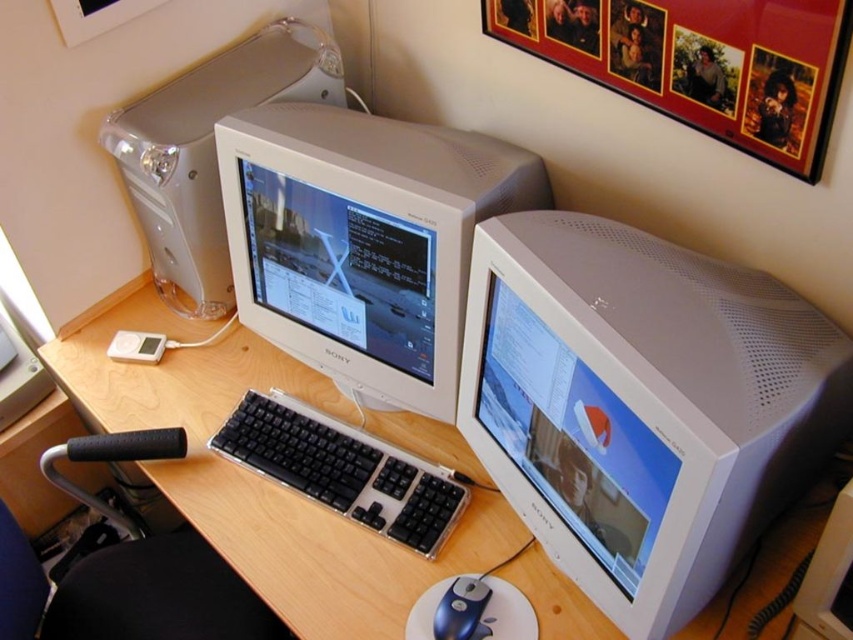
Question: Among these points, which one is farthest from the camera?

Choices:
 (A) (689, 588)
 (B) (136, 388)

Answer: (B)

Question: Which object is positioned closest to the white plastic monitor at center?

Choices:
 (A) white glossy monitor at center
 (B) black plastic keyboard at center
 (C) satin silver computer tower at upper left
 (D) wooden-framed photo at upper right

Answer: (A)

Question: Can you confirm if white plastic monitor at center is positioned below wooden-framed photo at upper right?

Choices:
 (A) yes
 (B) no

Answer: (A)

Question: Can you confirm if white glossy monitor at center is positioned to the right of black plastic keyboard at center?

Choices:
 (A) yes
 (B) no

Answer: (A)

Question: Considering the real-world distances, which object is closest to the white glossy monitor at center?

Choices:
 (A) wooden-framed photo at upper right
 (B) satin silver computer tower at upper left
 (C) blue plastic mouse at lower center

Answer: (B)

Question: Considering the relative positions of wooden-framed photo at upper right and satin silver computer tower at upper left in the image provided, where is wooden-framed photo at upper right located with respect to satin silver computer tower at upper left?

Choices:
 (A) left
 (B) right

Answer: (B)